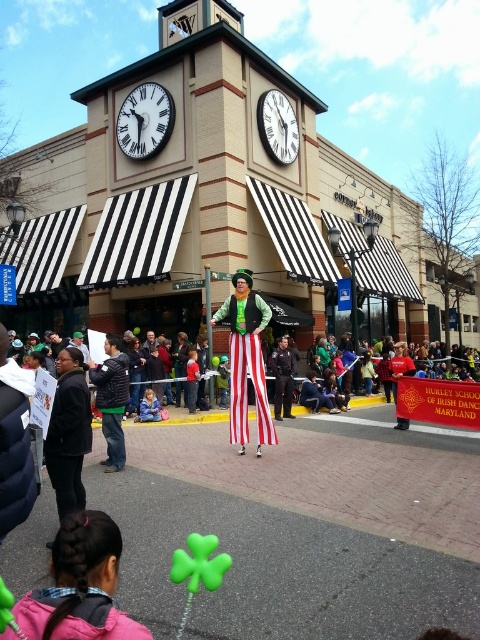
Question: Among these points, which one is nearest to the camera?

Choices:
 (A) (241, 358)
 (B) (78, 413)
 (C) (137, 156)
 (D) (85, 563)

Answer: (D)

Question: Is dark gray fleece jacket at center to the right of white glossy clock at upper center from the viewer's perspective?

Choices:
 (A) no
 (B) yes

Answer: (A)

Question: Which point appears farthest from the camera in this image?

Choices:
 (A) (243, 324)
 (B) (76, 624)

Answer: (A)

Question: Which object is positioned closest to the smooth black uniform at center?

Choices:
 (A) white matte clock at upper center
 (B) white glossy clock at upper center
 (C) dark gray fleece jacket at center

Answer: (C)

Question: Does pink fleece jacket at lower left lie in front of smooth black uniform at center?

Choices:
 (A) yes
 (B) no

Answer: (A)

Question: Considering the relative positions of white matte clock at upper center and white glossy clock at upper center in the image provided, where is white matte clock at upper center located with respect to white glossy clock at upper center?

Choices:
 (A) right
 (B) left

Answer: (B)